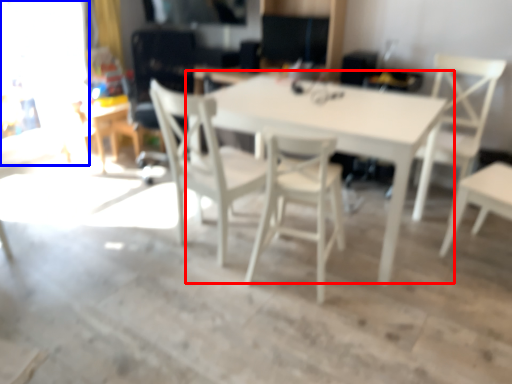
Question: Among these objects, which one is nearest to the camera, table (highlighted by a red box) or glass door (highlighted by a blue box)?

Choices:
 (A) table
 (B) glass door

Answer: (A)